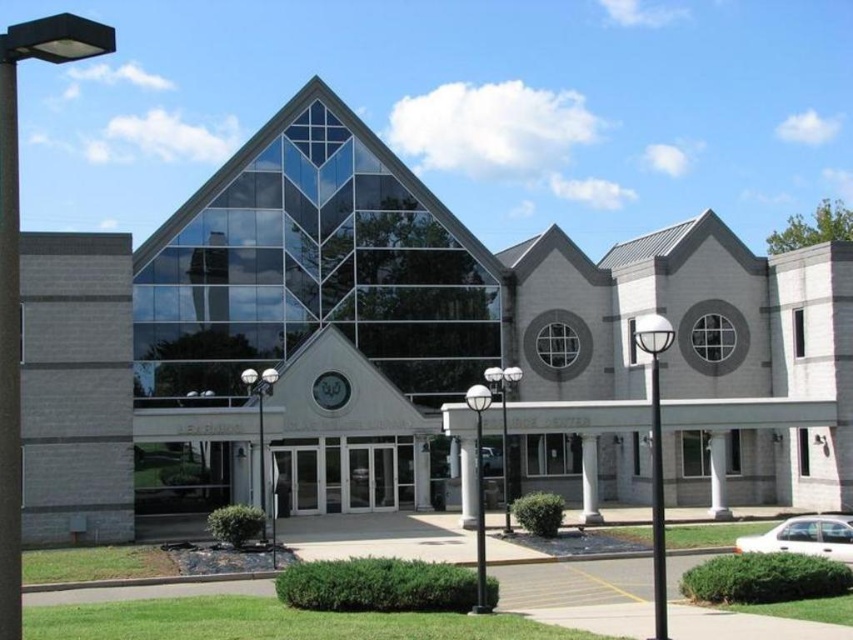
Can you confirm if white smooth column at center is smaller than white marble pillar at center?

Yes.

Is white smooth column at center positioned behind white marble pillar at center?

Yes, white smooth column at center is behind white marble pillar at center.

Does point (717, 465) lie in front of point (590, 493)?

No, (717, 465) is further to viewer.

At what (x,y) coordinates should I click in order to perform the action: click on white smooth column at center. Please return your answer as a coordinate pair (x, y). This screenshot has height=640, width=853. Looking at the image, I should click on (717, 476).

Who is shorter, white matte sedan at lower right or white concrete pillar at center?

white matte sedan at lower right is shorter.

Can you confirm if white matte sedan at lower right is shorter than white concrete pillar at center?

Yes, white matte sedan at lower right is shorter than white concrete pillar at center.

Describe the element at coordinates (805, 538) in the screenshot. I see `white matte sedan at lower right` at that location.

You are a GUI agent. You are given a task and a screenshot of the screen. Output one action in this format:
    pyautogui.click(x=<x>, y=<y>)
    Task: Click on the white matte sedan at lower right
    
    Given the screenshot: What is the action you would take?
    pyautogui.click(x=805, y=538)

Who is taller, white stone pillar at center or white concrete pillar at center?

With more height is white stone pillar at center.

What do you see at coordinates (468, 483) in the screenshot? I see `white stone pillar at center` at bounding box center [468, 483].

In order to click on white stone pillar at center in this screenshot , I will do `click(468, 483)`.

Find the location of a particular element. white stone pillar at center is located at coordinates (468, 483).